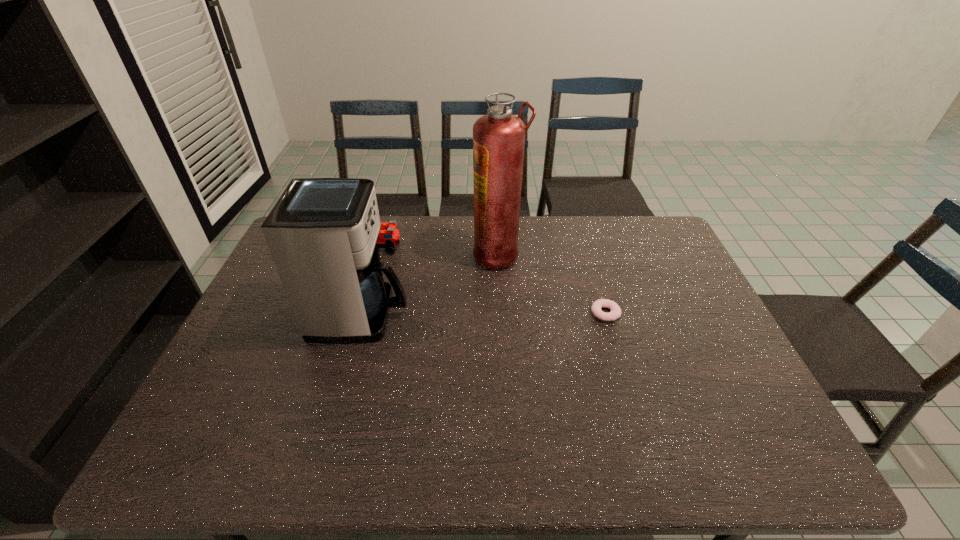
The width and height of the screenshot is (960, 540). In order to click on vacant point located 0.300m on the front-facing side of the Lego in this screenshot , I will do `click(491, 248)`.

Where is `free space located on the left of the shortest object`? The image size is (960, 540). free space located on the left of the shortest object is located at coordinates (563, 313).

Identify the location of fire extinguisher located in the far edge section of the desktop. (498, 137).

Find the location of a particular element. Lego positioned at the far edge is located at coordinates (389, 236).

Where is `vacant space at the far edge of the desktop`? vacant space at the far edge of the desktop is located at coordinates (434, 230).

In the image, there is a desktop. Where is `free space at the near edge`? free space at the near edge is located at coordinates (667, 465).

Identify the location of vacant space at the left edge of the desktop. (274, 351).

This screenshot has width=960, height=540. Identify the location of free region at the right edge of the desktop. (636, 258).

The width and height of the screenshot is (960, 540). What are the coordinates of `vacant space at the near left corner of the desktop` in the screenshot? It's located at (229, 457).

In the image, there is a desktop. Identify the location of vacant space at the far right corner. This screenshot has width=960, height=540. (639, 225).